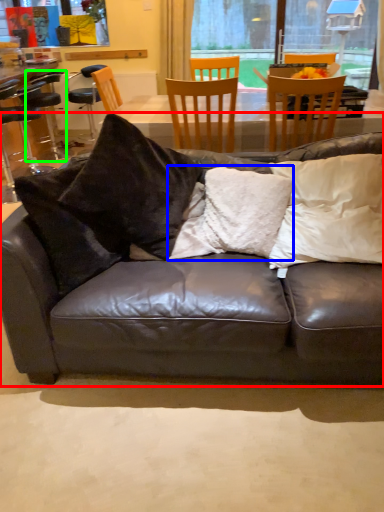
Question: Which is farther away from studio couch (highlighted by a red box)? pillow (highlighted by a blue box) or bar stool (highlighted by a green box)?

Choices:
 (A) pillow
 (B) bar stool

Answer: (B)